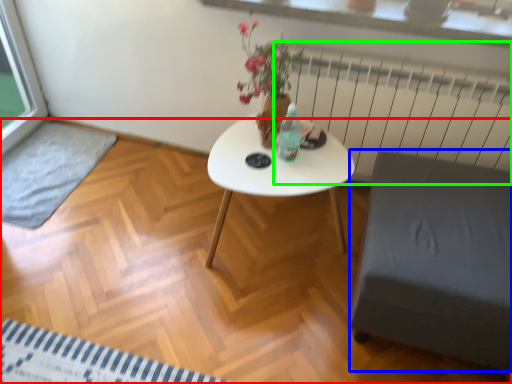
Question: Which is farther away from plain (highlighted by a red box)? armchair (highlighted by a blue box) or radiator (highlighted by a green box)?

Choices:
 (A) armchair
 (B) radiator

Answer: (B)